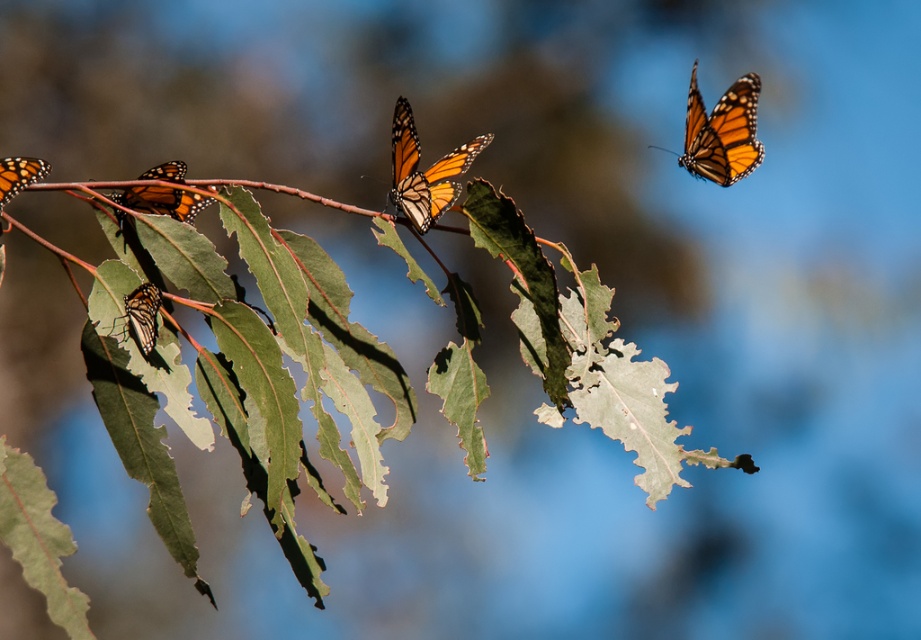
Question: Does green leafy branch at center have a greater width compared to orange matte butterfly at center?

Choices:
 (A) no
 (B) yes

Answer: (B)

Question: Can you confirm if orange matte butterfly at center is positioned above orange-patterned butterfly at lower left?

Choices:
 (A) yes
 (B) no

Answer: (A)

Question: Does green leafy branch at center have a greater width compared to orange matte butterfly at center?

Choices:
 (A) yes
 (B) no

Answer: (A)

Question: Which object appears farthest from the camera in this image?

Choices:
 (A) orange/patterned butterfly at upper right
 (B) orange-patterned butterfly at left

Answer: (A)

Question: Estimate the real-world distances between objects in this image. Which object is farther from the green leafy branch at center?

Choices:
 (A) orange/patterned butterfly at upper right
 (B) orange-patterned butterfly at left
 (C) orange and black wings at left
 (D) orange matte butterfly at center

Answer: (A)

Question: Based on their relative distances, which object is nearer to the green leafy branch at center?

Choices:
 (A) orange-patterned butterfly at lower left
 (B) orange matte butterfly at center
 (C) orange-patterned butterfly at left
 (D) orange/patterned butterfly at upper right

Answer: (C)